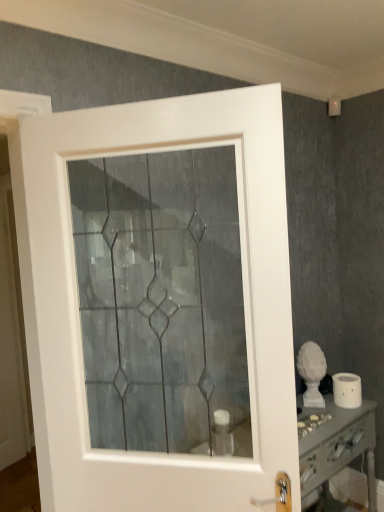
Question: From a real-world perspective, is white matte toilet paper at lower right over white glossy vanity at lower right?

Choices:
 (A) no
 (B) yes

Answer: (B)

Question: From the image's perspective, does white matte toilet paper at lower right appear lower than white glossy vanity at lower right?

Choices:
 (A) yes
 (B) no

Answer: (B)

Question: Considering the relative sizes of white matte toilet paper at lower right and white glossy vanity at lower right in the image provided, is white matte toilet paper at lower right shorter than white glossy vanity at lower right?

Choices:
 (A) no
 (B) yes

Answer: (B)

Question: Does white matte toilet paper at lower right have a larger size compared to white glossy vanity at lower right?

Choices:
 (A) no
 (B) yes

Answer: (A)

Question: Does white matte toilet paper at lower right lie behind white glossy vanity at lower right?

Choices:
 (A) no
 (B) yes

Answer: (B)

Question: Is white glossy vanity at lower right spatially inside white glossy door at center, or outside of it?

Choices:
 (A) outside
 (B) inside

Answer: (A)

Question: Considering the positions of white glossy vanity at lower right and white glossy door at center in the image, is white glossy vanity at lower right bigger or smaller than white glossy door at center?

Choices:
 (A) small
 (B) big

Answer: (B)

Question: Considering the positions of point (306, 428) and point (281, 157), is point (306, 428) closer or farther from the camera than point (281, 157)?

Choices:
 (A) closer
 (B) farther

Answer: (B)

Question: Considering the relative positions of white glossy vanity at lower right and white glossy door at center in the image provided, is white glossy vanity at lower right to the left or to the right of white glossy door at center?

Choices:
 (A) left
 (B) right

Answer: (B)

Question: Considering the positions of white matte toilet paper at lower right and white glossy vanity at lower right in the image, is white matte toilet paper at lower right bigger or smaller than white glossy vanity at lower right?

Choices:
 (A) big
 (B) small

Answer: (B)

Question: Which is correct: white matte toilet paper at lower right is inside white glossy vanity at lower right, or outside of it?

Choices:
 (A) inside
 (B) outside

Answer: (B)

Question: Is point (357, 384) positioned closer to the camera than point (337, 471)?

Choices:
 (A) closer
 (B) farther

Answer: (B)

Question: From the image's perspective, is white matte toilet paper at lower right above or below white glossy vanity at lower right?

Choices:
 (A) above
 (B) below

Answer: (A)

Question: From the image's perspective, is white matte toilet paper at lower right positioned above or below white glossy door at center?

Choices:
 (A) below
 (B) above

Answer: (A)

Question: Relative to white glossy door at center, is white matte toilet paper at lower right in front or behind?

Choices:
 (A) behind
 (B) front

Answer: (A)